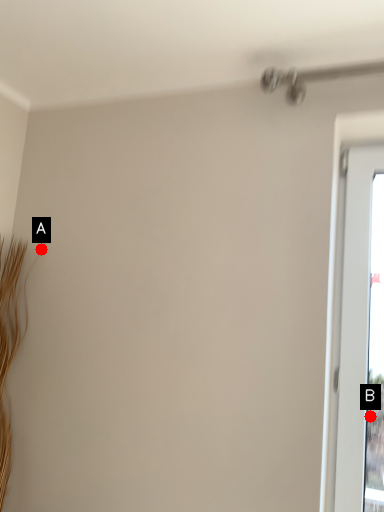
Question: Two points are circled on the image, labeled by A and B beside each circle. Among these points, which one is nearest to the camera?

Choices:
 (A) A is closer
 (B) B is closer

Answer: (A)